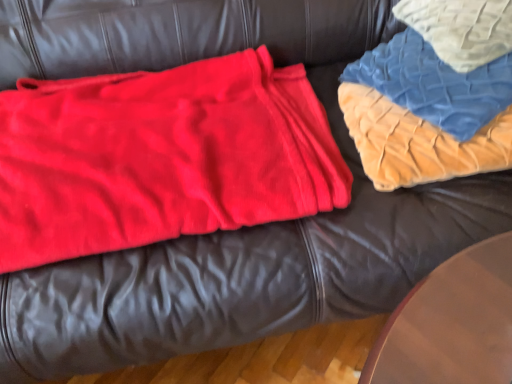
Question: From the image's perspective, is blue quilted fabric at upper right above or below velvet quilt at upper right?

Choices:
 (A) below
 (B) above

Answer: (B)

Question: Considering the positions of blue quilted fabric at upper right and velvet quilt at upper right in the image, is blue quilted fabric at upper right taller or shorter than velvet quilt at upper right?

Choices:
 (A) tall
 (B) short

Answer: (B)

Question: Which object is the closest to the velvet quilt at upper right?

Choices:
 (A) blue quilted fabric at upper right
 (B) matte red blanket at left

Answer: (A)

Question: Which object is the closest to the velvet quilt at upper right?

Choices:
 (A) matte red blanket at left
 (B) blue quilted fabric at upper right

Answer: (B)